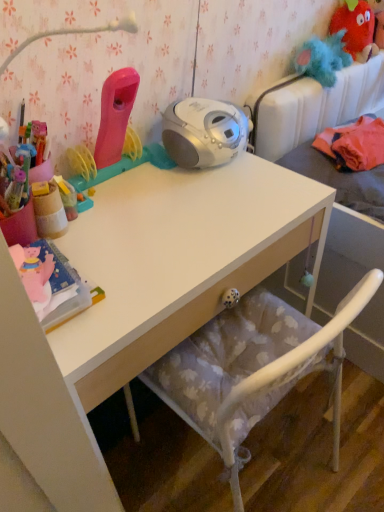
At what (x,y) coordinates should I click in order to perform the action: click on vacant location behind wooden pencil case at left. Please return your answer as a coordinate pair (x, y). The width and height of the screenshot is (384, 512). Looking at the image, I should click on (105, 193).